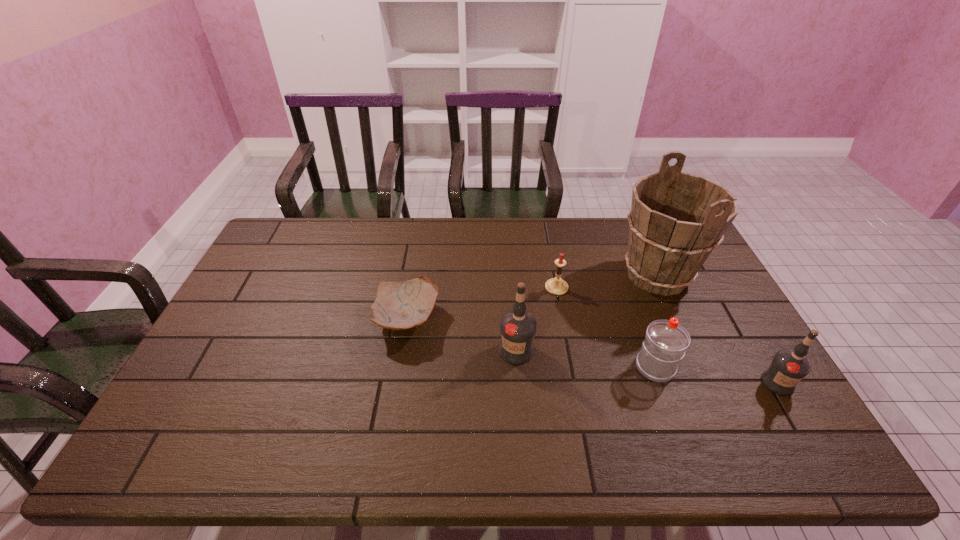
You are a GUI agent. You are given a task and a screenshot of the screen. Output one action in this format:
    pyautogui.click(x=<x>, y=<y>)
    Task: Click on the free location located on the front label of the taller vodka
    The width and height of the screenshot is (960, 540).
    Given the screenshot: What is the action you would take?
    pyautogui.click(x=519, y=394)

Where is `free point located 0.190m on the left of the tallest object`? This screenshot has width=960, height=540. free point located 0.190m on the left of the tallest object is located at coordinates (556, 275).

Where is `free space located on the left of the pottery`? The width and height of the screenshot is (960, 540). free space located on the left of the pottery is located at coordinates (247, 320).

Locate an element on the screen. free space located on the front of the fifth tallest object is located at coordinates (568, 351).

Locate an element on the screen. free location located 0.130m on the handle side of the water bottle is located at coordinates (637, 317).

Identify the location of free location located on the handle side of the water bottle. The image size is (960, 540). (640, 325).

Find the location of a particular element. The height and width of the screenshot is (540, 960). free space located on the handle side of the water bottle is located at coordinates pyautogui.click(x=627, y=287).

The height and width of the screenshot is (540, 960). I want to click on object that is at the far edge, so click(676, 220).

The image size is (960, 540). I want to click on object that is at the near edge, so click(788, 367).

What are the coordinates of `vodka positioned at the right edge` in the screenshot? It's located at (788, 367).